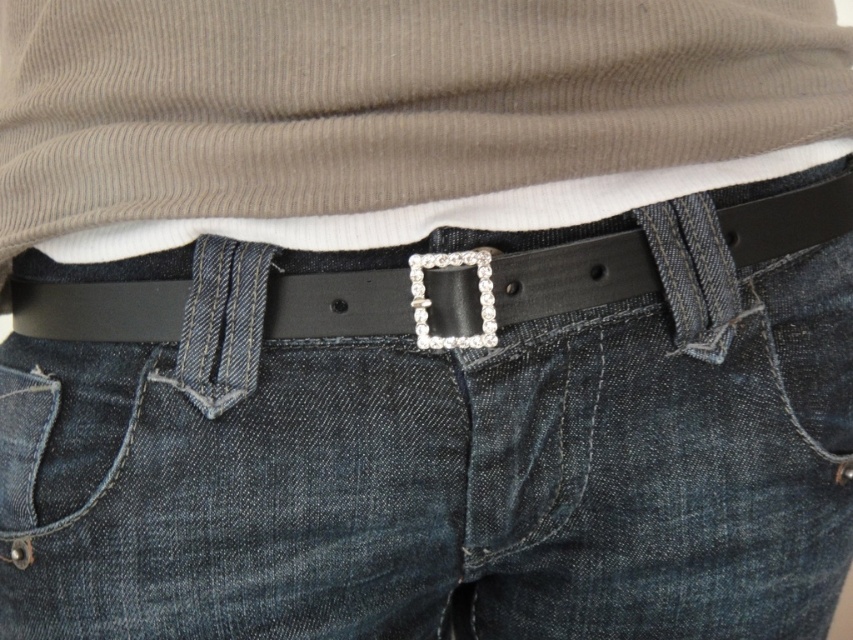
You are a tailor measuring a customer for a new belt. You see the point marked at coordinates point (572, 276) on their waist. Is this point likely located on the black leather belt at center?

Yes, the point (572, 276) corresponds to the black leather belt at center, so the point is located on the belt.

You are a fashion designer trying to create a new outfit. You have a matte brown ribbed shirt at center and a black leather belt at center. Which item should you adjust in length to ensure the belt sits properly over the shirt?

The matte brown ribbed shirt at center has a greater height compared to the black leather belt at center. To ensure the belt sits properly over the shirt, you should shorten the shirt so that the belt can be positioned above it without overlapping too much.